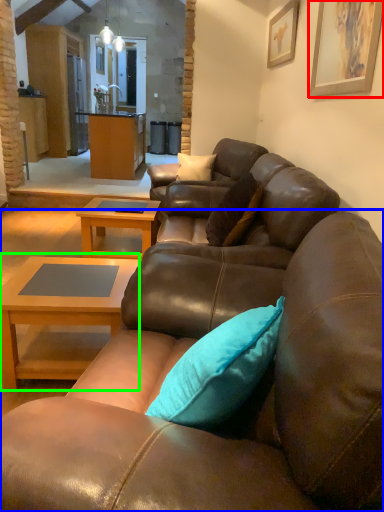
Question: Which object is positioned farthest from picture frame (highlighted by a red box)? Select from studio couch (highlighted by a blue box) and coffee table (highlighted by a green box).

Choices:
 (A) studio couch
 (B) coffee table

Answer: (B)